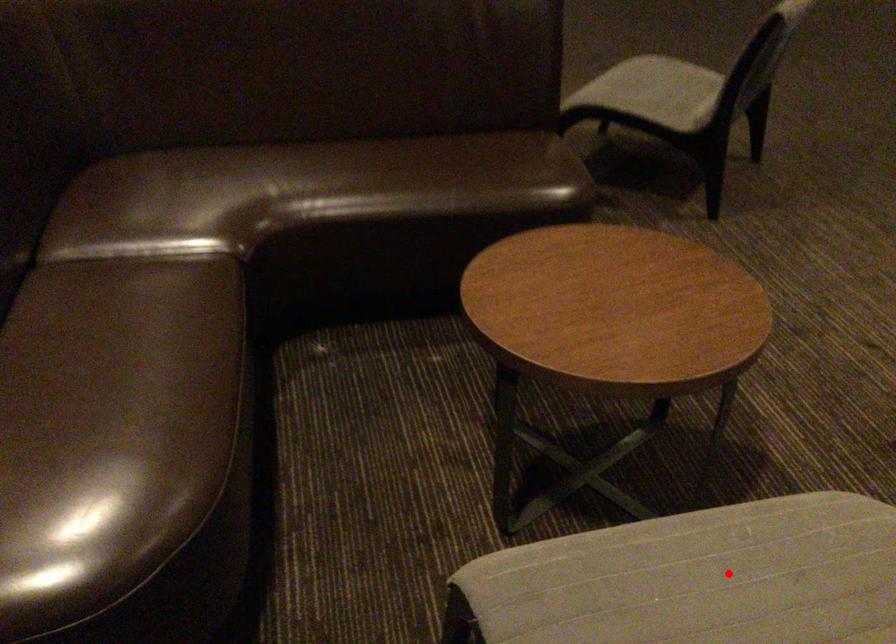
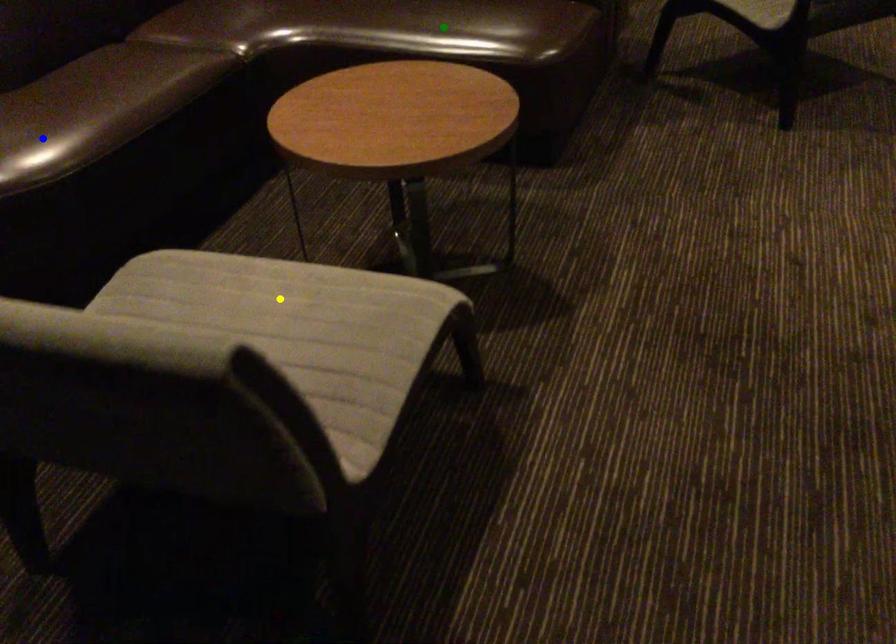
Question: I am providing you with two images of the same scene from different viewpoints. A red point is marked on the first image. You are given multiple points on the second image. Which mark in image 2 goes with the point in image 1?

Choices:
 (A) green point
 (B) blue point
 (C) yellow point

Answer: (C)